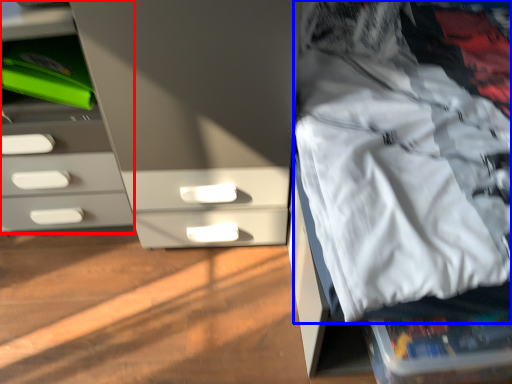
Question: Which of the following is the farthest to the observer, chest of drawers (highlighted by a red box) or clothing (highlighted by a blue box)?

Choices:
 (A) chest of drawers
 (B) clothing

Answer: (A)